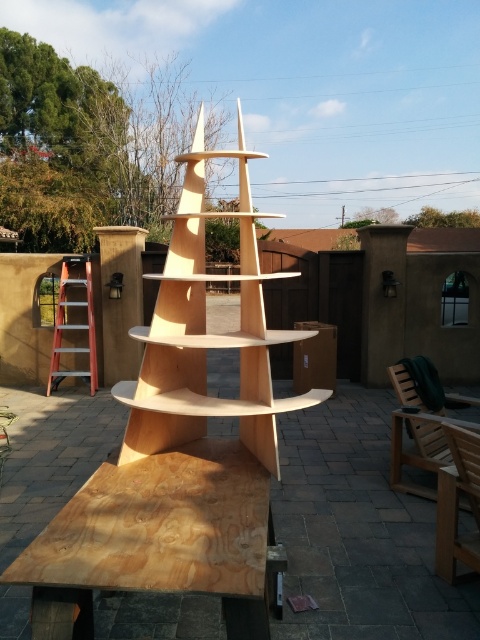
You are a painter who needs to reach the top of the natural wood shelf at center to paint it. You have the orange metallic ladder at left available. Considering their heights, will the ladder be tall enough to safely reach the top of the shelf?

The natural wood shelf at center is shorter than the orange metallic ladder at left, so the ladder is taller than the shelf. Therefore, the ladder should be tall enough to safely reach the top of the shelf.

You are standing at the entrance of the outdoor area and want to place a potted plant on the natural wood shelf at center. However, you need to first move the orange metallic ladder at left out of the way. Which direction should you move the ladder to access the shelf?

The natural wood shelf at center is to the right of the orange metallic ladder at left, so you should move the orange metallic ladder at left to the left to access the natural wood shelf at center.

You are setting up a picnic and need to place a blanket between the plywood picnic table at lower left and the natural wood shelf at center. Based on their positions, which object should the blanket be placed closer to?

The plywood picnic table at lower left is positioned on the left side of the natural wood shelf at center, so the blanket should be placed closer to the plywood picnic table at lower left to ensure it is between them.